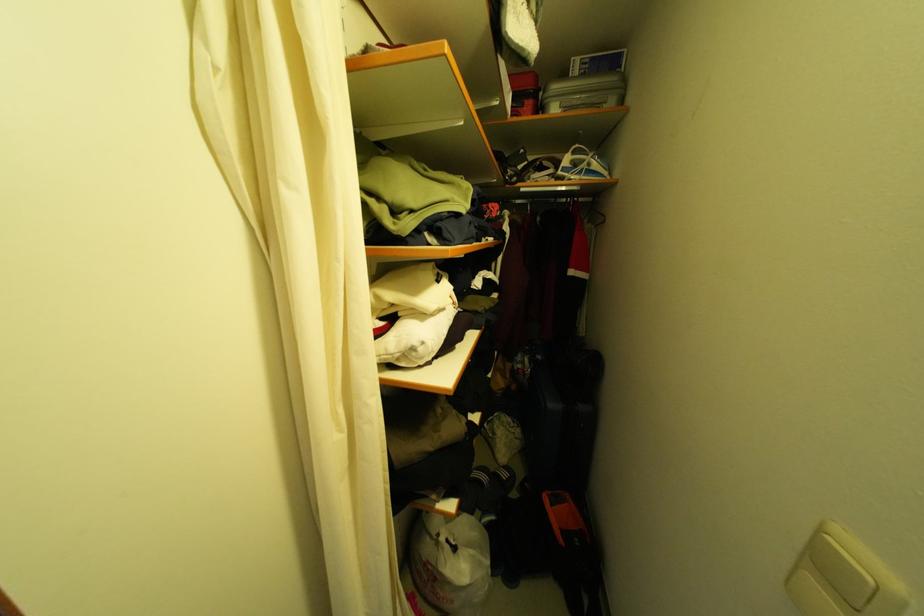
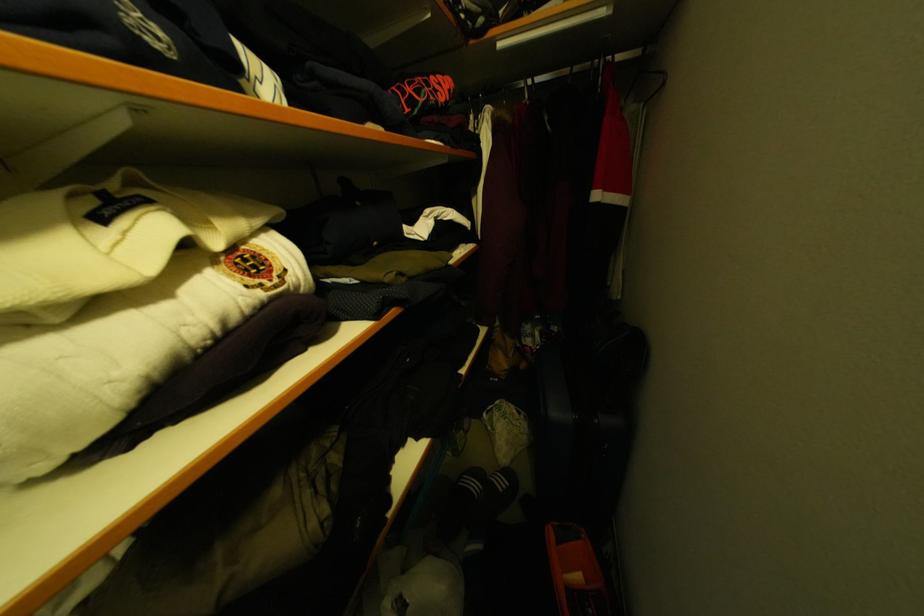
Find the pixel in the second image that matches point 552,499 in the first image.

(555, 533)